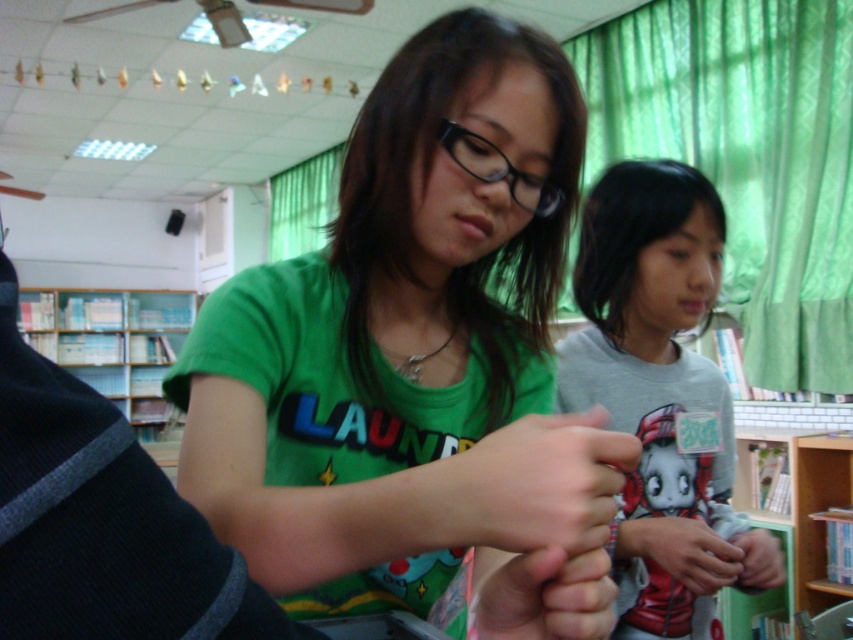
Question: Which object is farther from the camera taking this photo?

Choices:
 (A) green wooden bookshelf at lower right
 (B) smooth skin hand at center
 (C) matte plastic hand at center
 (D) green matte shirt at center

Answer: (A)

Question: Does green matte shirt at center have a greater width compared to gray matte shirt at center?

Choices:
 (A) no
 (B) yes

Answer: (B)

Question: Is green wooden bookshelf at lower right smaller than smooth skin hand at center?

Choices:
 (A) yes
 (B) no

Answer: (B)

Question: Which of the following is the closest to the observer?

Choices:
 (A) (570, 588)
 (B) (769, 534)

Answer: (A)

Question: Considering the real-world distances, which object is farthest from the matte plastic hand at center?

Choices:
 (A) smooth skin hand at center
 (B) matte black hand at center
 (C) green matte shirt at center
 (D) matte green shirt at center

Answer: (D)

Question: Can you confirm if green wooden bookshelf at lower right is positioned to the right of matte black hand at center?

Choices:
 (A) no
 (B) yes

Answer: (B)